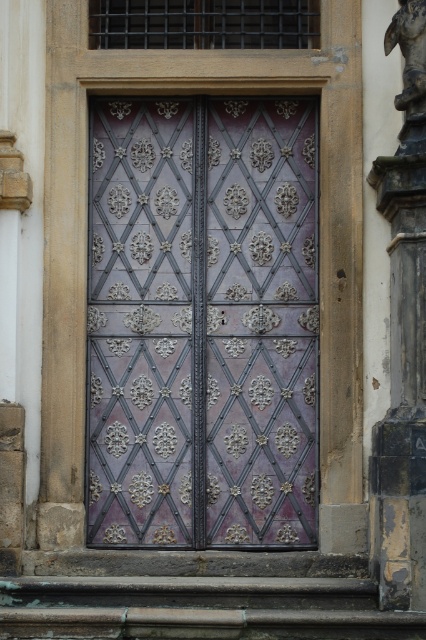
Question: Does purple metallic door at center have a larger size compared to dark gray stone pillar at right?

Choices:
 (A) no
 (B) yes

Answer: (B)

Question: Which point is farther to the camera?

Choices:
 (A) (313, 216)
 (B) (422, 296)

Answer: (A)

Question: Is purple metallic door at center in front of dark gray stone pillar at right?

Choices:
 (A) no
 (B) yes

Answer: (A)

Question: Is purple metallic door at center above dark gray stone pillar at right?

Choices:
 (A) no
 (B) yes

Answer: (B)